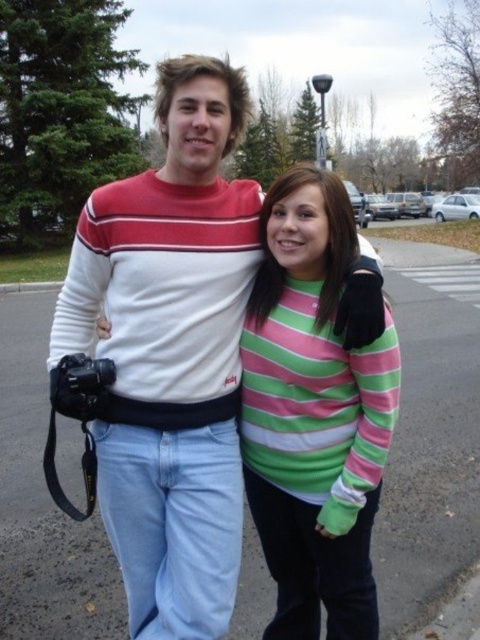
How distant is white striped sweater at center from striped cotton sweater at center?

The distance of white striped sweater at center from striped cotton sweater at center is 12.99 inches.

What are the coordinates of `white striped sweater at center` in the screenshot? It's located at (169, 353).

Which is in front, point (231, 67) or point (307, 339)?

Point (307, 339) is in front.

Identify the location of white striped sweater at center. (169, 353).